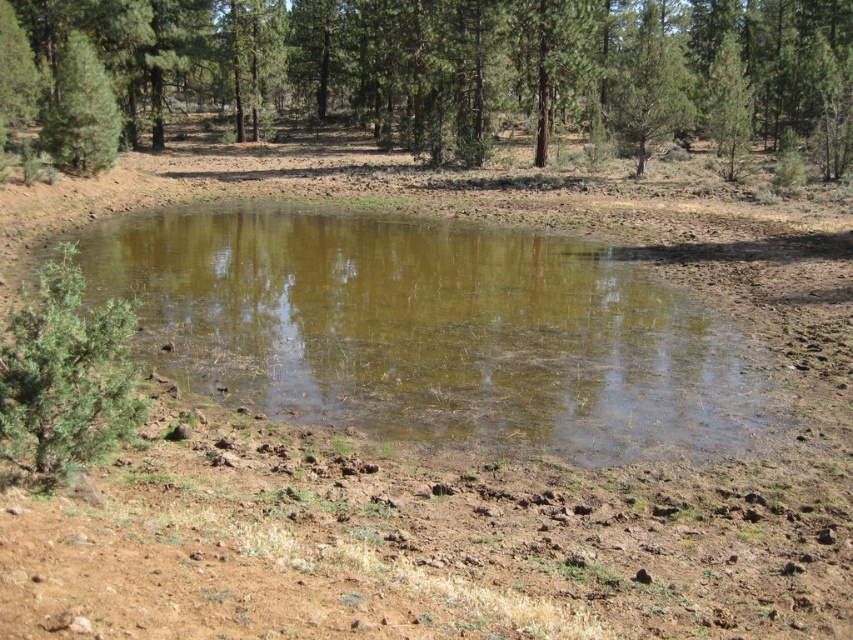
You are standing at the edge of the pond and want to look up at the green matte tree at upper left. Which direction should you face to see its reflection in the brown murky water at center?

You should face the direction where the green matte tree at upper left is located because its reflection would appear in the brown murky water at center below it.